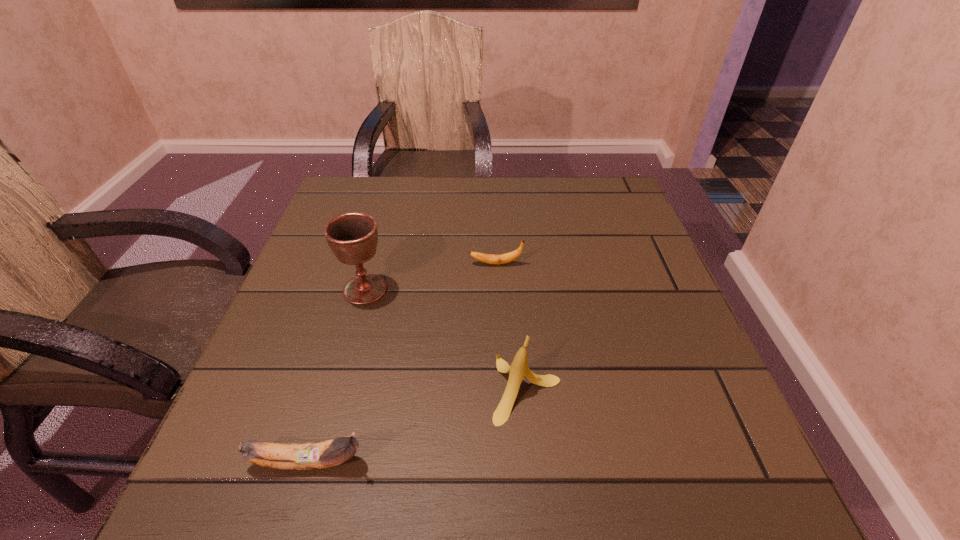
Find the location of a particular element. The height and width of the screenshot is (540, 960). vacant area that lies between the second nearest object and the farthest banana is located at coordinates (512, 326).

Image resolution: width=960 pixels, height=540 pixels. Find the location of `free area in between the chalice and the farthest object`. free area in between the chalice and the farthest object is located at coordinates (430, 276).

This screenshot has height=540, width=960. I want to click on vacant space that is in between the shortest banana and the nearest object, so click(402, 363).

Find the location of a particular element. free area in between the second farthest object and the nearest banana is located at coordinates (337, 376).

I want to click on object that is the closest to the nearest banana, so click(519, 369).

Where is `object identified as the third closest to the farthest object`? The image size is (960, 540). object identified as the third closest to the farthest object is located at coordinates (315, 455).

Locate which banana is the second closest to the third farthest object. Please provide its 2D coordinates. Your answer should be formatted as a tuple, i.e. [(x, y)], where the tuple contains the x and y coordinates of a point satisfying the conditions above.

[(505, 258)]

In order to click on banana that is the second closest to the shortest banana in this screenshot , I will do `click(315, 455)`.

Where is `vacant position in the image that satisfies the following two spatial constraints: 1. on the peel of the shortest object from the top; 2. on the back side of the second nearest object`? This screenshot has height=540, width=960. vacant position in the image that satisfies the following two spatial constraints: 1. on the peel of the shortest object from the top; 2. on the back side of the second nearest object is located at coordinates (501, 388).

The image size is (960, 540). In order to click on free location that satisfies the following two spatial constraints: 1. on the peel of the shortest object from the top; 2. on the back side of the second farthest banana in this screenshot , I will do [501, 388].